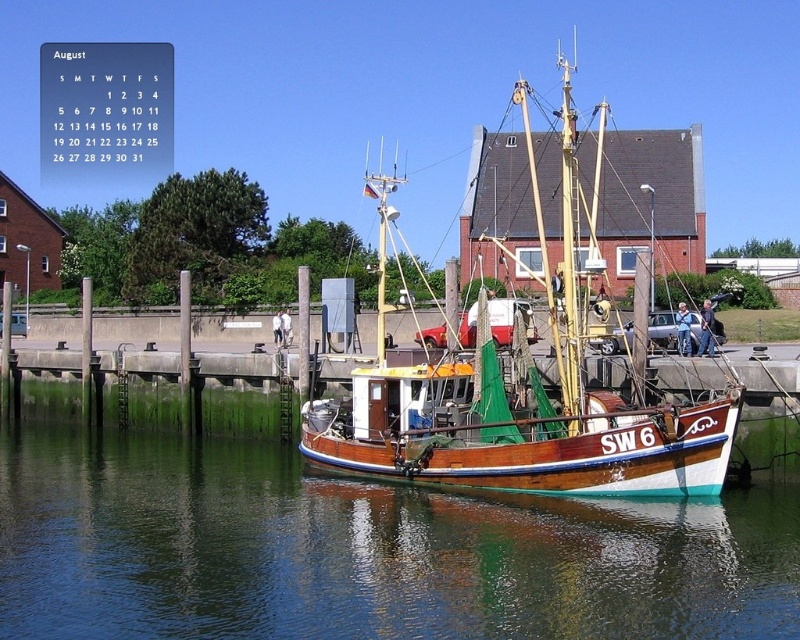
Consider the image. Which is below, glossy water at boat right or wooden boat at center?

glossy water at boat right is lower down.

Identify the location of glossy water at boat right. The image size is (800, 640). (364, 552).

Is point (412, 518) farther from camera compared to point (478, 451)?

No, it is not.

Identify the location of glossy water at boat right. This screenshot has width=800, height=640. (364, 552).